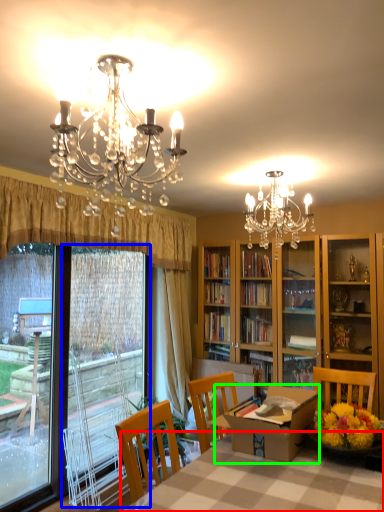
Question: Based on their relative distances, which object is farther from table (highlighted by a red box)? Choose from screen door (highlighted by a blue box) and round table (highlighted by a green box).

Choices:
 (A) screen door
 (B) round table

Answer: (A)